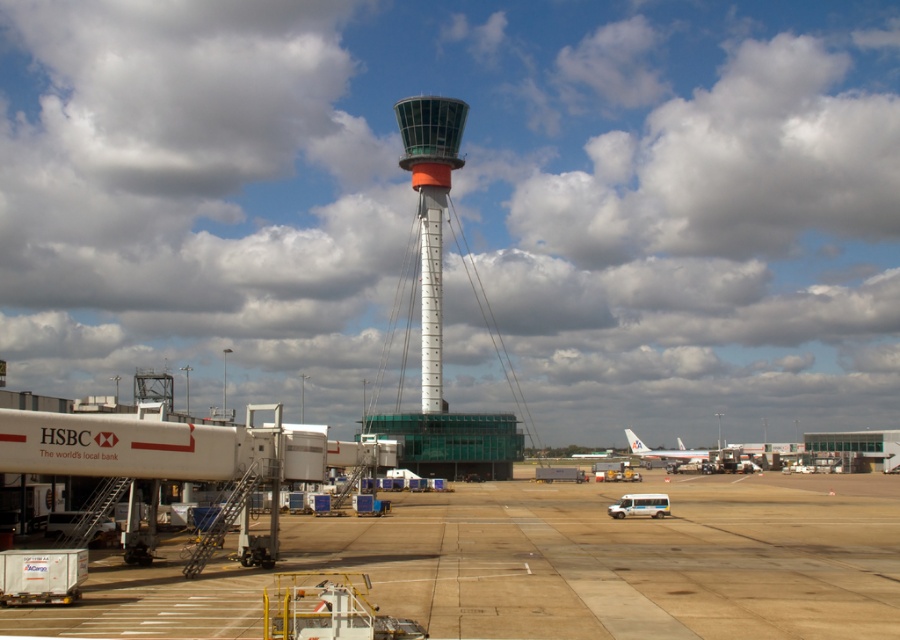
In the scene shown: Does white smooth control tower at center come behind white matte airplane at lower right?

No.

Which is in front, point (412, 186) or point (655, 452)?

Point (412, 186) is in front.

Does point (408, 147) come in front of point (680, 456)?

Yes, point (408, 147) is in front of point (680, 456).

What are the coordinates of `white smooth control tower at center` in the screenshot? It's located at [430, 214].

Can you confirm if brown concrete tarmac at center is positioned above white metallic control tower at center?

Incorrect, brown concrete tarmac at center is not positioned above white metallic control tower at center.

Who is higher up, brown concrete tarmac at center or white metallic control tower at center?

Positioned higher is white metallic control tower at center.

Which is behind, point (700, 524) or point (428, 268)?

The point (428, 268) is behind.

You are a GUI agent. You are given a task and a screenshot of the screen. Output one action in this format:
    pyautogui.click(x=<x>, y=<y>)
    Task: Click on the brown concrete tarmac at center
    The image size is (900, 640).
    Given the screenshot: What is the action you would take?
    pyautogui.click(x=550, y=564)

Can you confirm if brown concrete tarmac at center is bigger than white matte airplane at lower right?

No.

Is brown concrete tarmac at center taller than white matte airplane at lower right?

No.

Between point (419, 596) and point (666, 452), which one is positioned behind?

Point (666, 452)

Image resolution: width=900 pixels, height=640 pixels. Find the location of `brown concrete tarmac at center`. brown concrete tarmac at center is located at coordinates (550, 564).